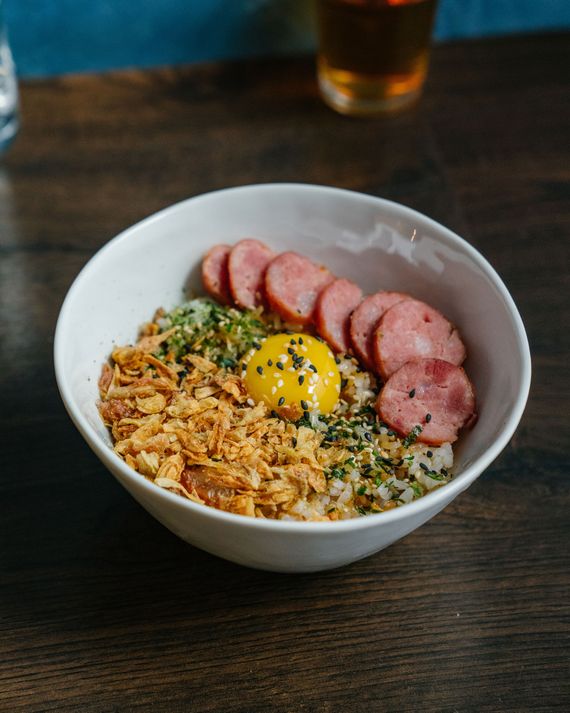
Where is `table`? The image size is (570, 713). table is located at coordinates (467, 619).